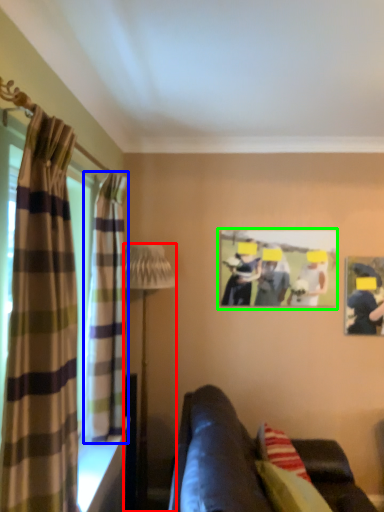
Question: Which object is the farthest from lamp (highlighted by a red box)? Choose among these: curtain (highlighted by a blue box) or picture frame (highlighted by a green box).

Choices:
 (A) curtain
 (B) picture frame

Answer: (B)